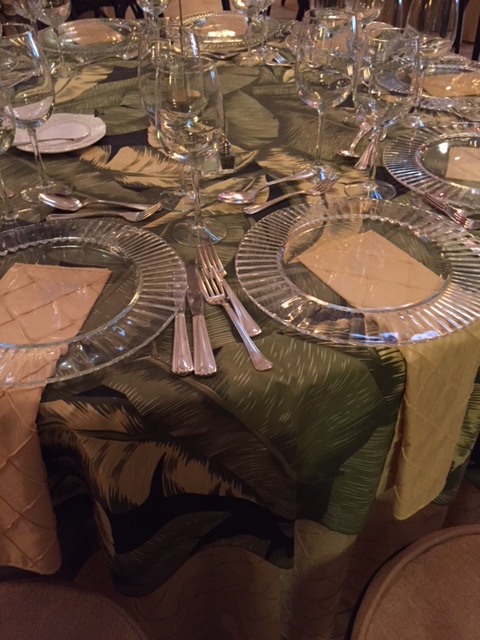
Locate an element on the screen. The width and height of the screenshot is (480, 640). chair backs is located at coordinates (428, 589), (60, 618).